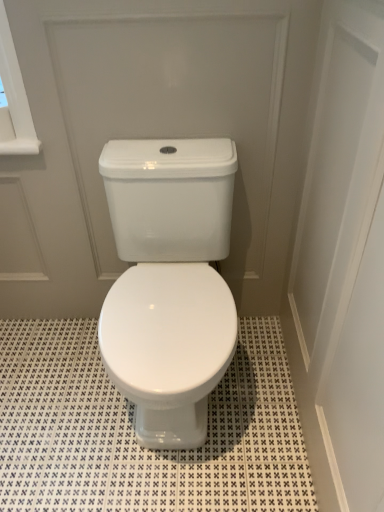
In order to face white glossy door at upper center, the 2th screen door positioned from the left, should I rotate leftwards or rightwards?

Rotate right and turn 18.358 degrees.

This screenshot has width=384, height=512. I want to click on white glossy toilet at center, the 2th screen door when ordered from right to left, so click(x=174, y=106).

The width and height of the screenshot is (384, 512). Identify the location of white glossy tile at center. (134, 430).

Where is `screen door below the white glossy door at upper center, the 2th screen door positioned from the left (from a real-world perspective)`? The image size is (384, 512). screen door below the white glossy door at upper center, the 2th screen door positioned from the left (from a real-world perspective) is located at coordinates (174, 106).

Between white glossy toilet at center, the 2th screen door when ordered from right to left, and white glossy door at upper center, placed as the 1th screen door when sorted from right to left, which one is positioned in front?

white glossy door at upper center, placed as the 1th screen door when sorted from right to left, is more forward.

Considering the relative sizes of white glossy toilet at center, the 2th screen door when ordered from right to left, and white glossy door at upper center, placed as the 1th screen door when sorted from right to left, in the image provided, is white glossy toilet at center, the 2th screen door when ordered from right to left, wider than white glossy door at upper center, placed as the 1th screen door when sorted from right to left,?

No.

Is white glossy toilet at center, acting as the 1th screen door starting from the left, oriented towards white glossy door at upper center, the 2th screen door positioned from the left?

Yes, white glossy toilet at center, acting as the 1th screen door starting from the left, faces towards white glossy door at upper center, the 2th screen door positioned from the left.

Is white glossy toilet at center, acting as the 1th screen door starting from the left, not within white glossy tile at center?

Yes.

How many degrees apart are the facing directions of white glossy toilet at center, the 2th screen door when ordered from right to left, and white glossy tile at center?

The facing directions of white glossy toilet at center, the 2th screen door when ordered from right to left, and white glossy tile at center are 0.489 degrees apart.

The width and height of the screenshot is (384, 512). Find the location of `screen door that is the 1st one when counting rightward from the white glossy tile at center`. screen door that is the 1st one when counting rightward from the white glossy tile at center is located at coordinates pyautogui.click(x=174, y=106).

Which of these two, white glossy tile at center or white glossy door at upper center, the 2th screen door positioned from the left, is bigger?

white glossy door at upper center, the 2th screen door positioned from the left, is bigger.

Does point (70, 492) lie in front of point (328, 210)?

No.

From a real-world perspective, which screen door is the 2nd one above the white glossy tile at center? Please provide its 2D coordinates.

[(344, 260)]

Is white glossy door at upper center, placed as the 1th screen door when sorted from right to left, at the back of white glossy tile at center?

white glossy tile at center does not have its back to white glossy door at upper center, placed as the 1th screen door when sorted from right to left.

Which screen door is the 1st one when counting from the right side of the white glossy tile at center? Please provide its 2D coordinates.

[(174, 106)]

Which object is more forward, white glossy tile at center or white glossy toilet at center, acting as the 1th screen door starting from the left?

white glossy toilet at center, acting as the 1th screen door starting from the left, is in front.

Is white glossy tile at center outside of white glossy toilet at center, acting as the 1th screen door starting from the left?

Yes, white glossy tile at center is not within white glossy toilet at center, acting as the 1th screen door starting from the left.

In the scene shown: In terms of width, does white glossy tile at center look wider or thinner when compared to white glossy toilet at center, acting as the 1th screen door starting from the left?

In the image, white glossy tile at center appears to be wider than white glossy toilet at center, acting as the 1th screen door starting from the left.

Is white glossy door at upper center, the 2th screen door positioned from the left, to the right of white glossy tile at center from the viewer's perspective?

Correct, you'll find white glossy door at upper center, the 2th screen door positioned from the left, to the right of white glossy tile at center.

Who is shorter, white glossy door at upper center, the 2th screen door positioned from the left, or white glossy tile at center?

Standing shorter between the two is white glossy tile at center.

Considering the positions of points (348, 461) and (103, 372), is point (348, 461) closer to camera compared to point (103, 372)?

Yes, it is.

Is white glossy door at upper center, placed as the 1th screen door when sorted from right to left, spatially inside white glossy tile at center, or outside of it?

The correct answer is: outside.

Locate an element on the screen. This screenshot has height=512, width=384. screen door beneath the white glossy door at upper center, the 2th screen door positioned from the left (from a real-world perspective) is located at coordinates (174, 106).

Which object is further away from the camera, white glossy door at upper center, the 2th screen door positioned from the left, or white glossy toilet at center, acting as the 1th screen door starting from the left?

white glossy toilet at center, acting as the 1th screen door starting from the left, is more distant.

The image size is (384, 512). What are the coordinates of `screen door located on the right of white glossy toilet at center, acting as the 1th screen door starting from the left` in the screenshot? It's located at (344, 260).

Locate an element on the screen. This screenshot has width=384, height=512. screen door that is the 2nd one when counting upward from the white glossy tile at center (from the image's perspective) is located at coordinates (174, 106).

When comparing their distances from white glossy tile at center, does white glossy toilet at center, acting as the 1th screen door starting from the left, or white glossy door at upper center, placed as the 1th screen door when sorted from right to left, seem further?

The object further to white glossy tile at center is white glossy toilet at center, acting as the 1th screen door starting from the left.

Which object lies nearer to the anchor point white glossy door at upper center, placed as the 1th screen door when sorted from right to left, white glossy toilet at center, the 2th screen door when ordered from right to left, or white glossy tile at center?

Among the two, white glossy toilet at center, the 2th screen door when ordered from right to left, is located nearer to white glossy door at upper center, placed as the 1th screen door when sorted from right to left.

Looking at the image, which one is located further to white glossy door at upper center, the 2th screen door positioned from the left, white glossy tile at center or white glossy toilet at center, the 2th screen door when ordered from right to left?

Based on the image, white glossy tile at center appears to be further to white glossy door at upper center, the 2th screen door positioned from the left.

Looking at the image, which one is located further to white glossy tile at center, white glossy door at upper center, the 2th screen door positioned from the left, or white glossy toilet at center, acting as the 1th screen door starting from the left?

Among the two, white glossy toilet at center, acting as the 1th screen door starting from the left, is located further to white glossy tile at center.

Based on their spatial positions, is white glossy door at upper center, placed as the 1th screen door when sorted from right to left, or white glossy tile at center further from white glossy toilet at center, the 2th screen door when ordered from right to left?

white glossy tile at center lies further to white glossy toilet at center, the 2th screen door when ordered from right to left, than the other object.

Looking at the image, which one is located further to white glossy toilet at center, acting as the 1th screen door starting from the left, white glossy tile at center or white glossy door at upper center, placed as the 1th screen door when sorted from right to left?

Based on the image, white glossy tile at center appears to be further to white glossy toilet at center, acting as the 1th screen door starting from the left.

Where is `screen door between white glossy door at upper center, placed as the 1th screen door when sorted from right to left, and white glossy tile at center in the front-back direction`? The height and width of the screenshot is (512, 384). screen door between white glossy door at upper center, placed as the 1th screen door when sorted from right to left, and white glossy tile at center in the front-back direction is located at coordinates (174, 106).